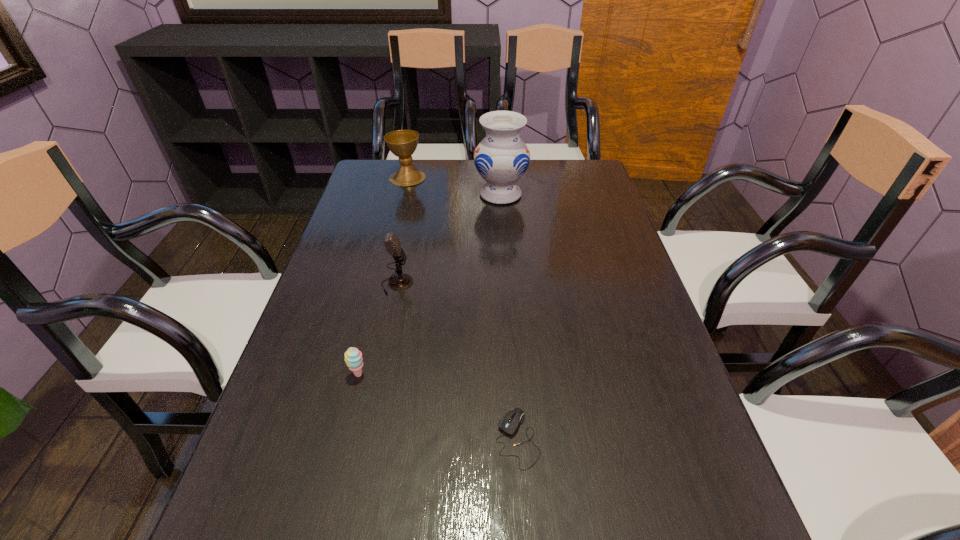
Locate an element on the screen. the tallest object is located at coordinates (501, 158).

Where is `chalice`? This screenshot has height=540, width=960. chalice is located at coordinates (402, 143).

What are the coordinates of `the third farthest object` in the screenshot? It's located at (401, 281).

Locate an element on the screen. This screenshot has width=960, height=540. sherbert is located at coordinates (x=353, y=357).

At what (x,y) coordinates should I click in order to perform the action: click on the second shortest object. Please return your answer as a coordinate pair (x, y). The image size is (960, 540). Looking at the image, I should click on (353, 357).

The image size is (960, 540). In order to click on computer mouse in this screenshot , I will do `click(513, 419)`.

Identify the location of the shortest object. click(513, 419).

The height and width of the screenshot is (540, 960). I want to click on free space located on the front of the vase, so click(x=507, y=292).

Locate an element on the screen. This screenshot has height=540, width=960. vacant space located on the front of the chalice is located at coordinates (398, 214).

You are a GUI agent. You are given a task and a screenshot of the screen. Output one action in this format:
    pyautogui.click(x=<x>, y=<y>)
    Task: Click on the free location located on the front-facing side of the microphone
    Image resolution: width=960 pixels, height=540 pixels.
    Given the screenshot: What is the action you would take?
    pyautogui.click(x=537, y=284)